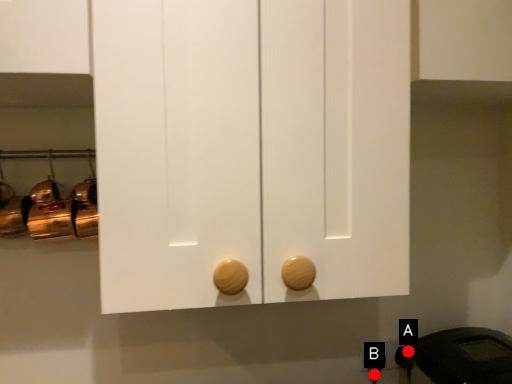
Question: Two points are circled on the image, labeled by A and B beside each circle. Which point is closer to the camera?

Choices:
 (A) A is closer
 (B) B is closer

Answer: (B)